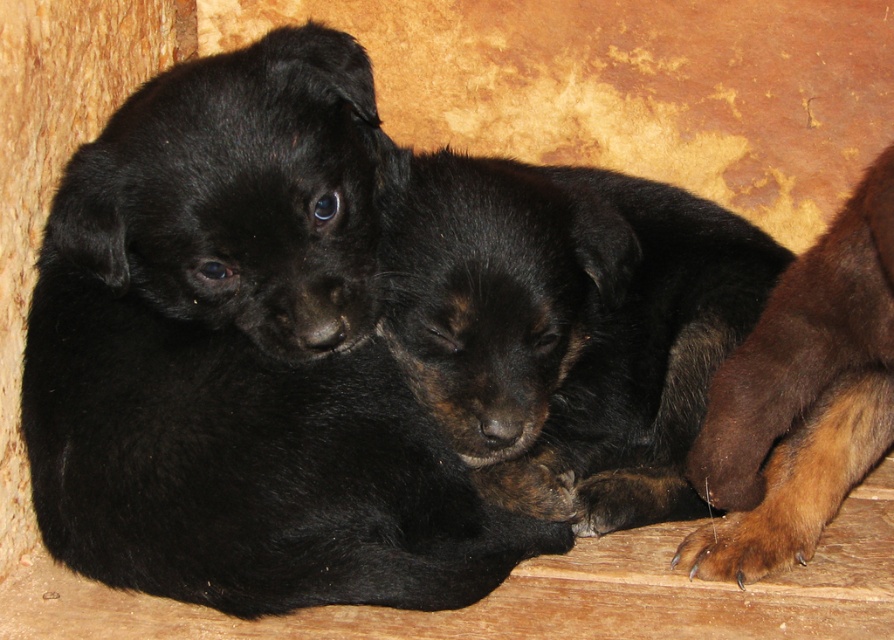
Question: From the image, what is the correct spatial relationship of black fur dog at center in relation to black fur puppy at upper left?

Choices:
 (A) right
 (B) left

Answer: (A)

Question: Which object is positioned closest to the black fur puppy at upper left?

Choices:
 (A) black fur dog at center
 (B) brown fuzzy paw at lower right

Answer: (A)

Question: Which point is farther to the camera?

Choices:
 (A) (344, 70)
 (B) (138, 253)
 (C) (748, 304)

Answer: (C)

Question: Observing the image, what is the correct spatial positioning of black fur puppies at center in reference to black fur dog at center?

Choices:
 (A) right
 (B) left

Answer: (B)

Question: Can you confirm if black fur dog at center is smaller than black fur puppy at upper left?

Choices:
 (A) yes
 (B) no

Answer: (B)

Question: Based on their relative distances, which object is nearer to the black fur puppies at center?

Choices:
 (A) black fur puppy at upper left
 (B) brown fuzzy paw at lower right

Answer: (A)